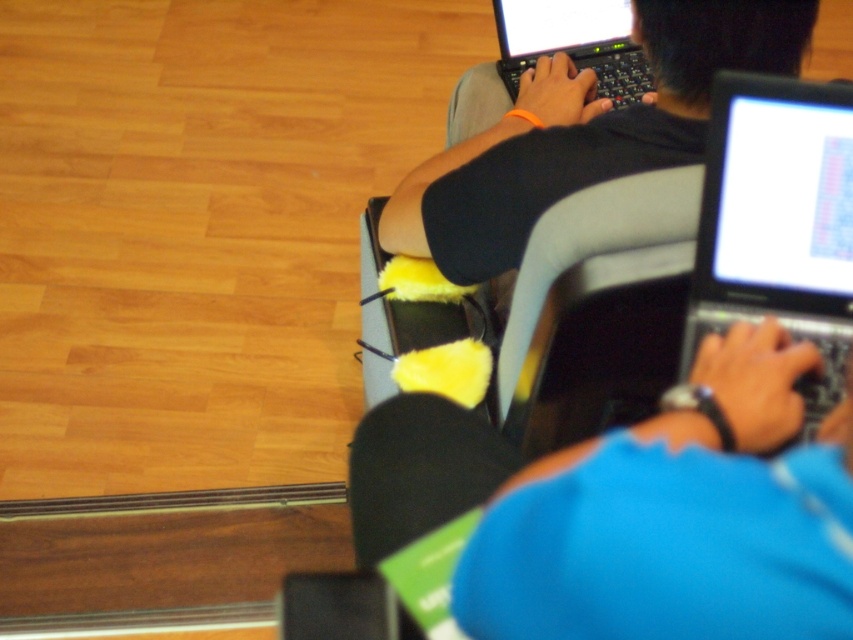
You are a student trying to locate your laptop in a classroom. You see the black glossy laptop at right and the black plastic laptop at upper center. Which one is closer to you?

The black glossy laptop at right is closer to you because it is in front of the black plastic laptop at upper center.

You are a student trying to locate your matte black laptop at upper center in a classroom. The teacher mentioned it should be at coordinates point0.208, 0.686. Can you confirm if your laptop is at the correct location?

The matte black laptop at upper center is indeed located at point0.(584, 639), so it is at the correct location.

You are trying to decide where to sit in the classroom. You see the matte black laptop at upper center and the gray fabric armchair at center. Which object is higher up?

The matte black laptop at upper center is located above the gray fabric armchair at center, so it is higher up.